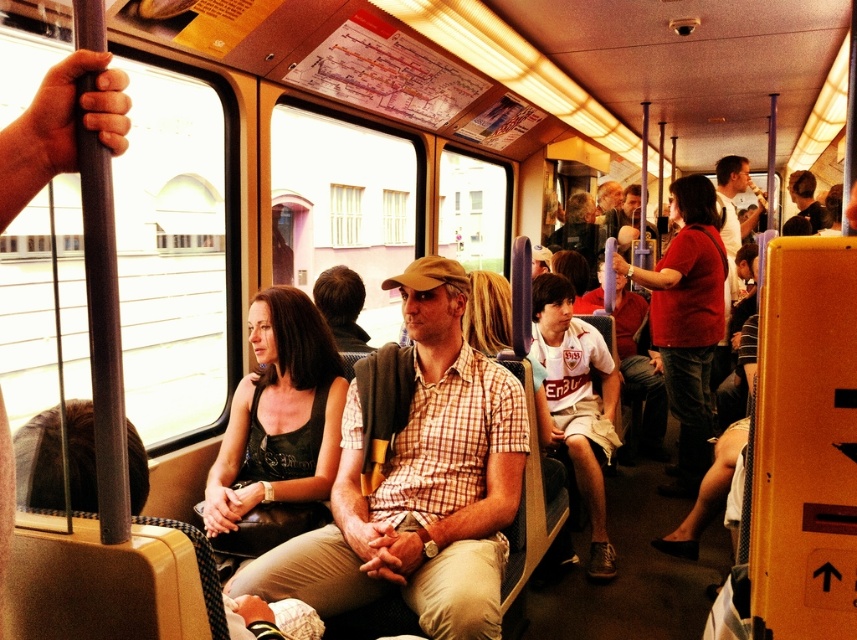
You are standing at the point marked as point (577, 401) in the image. What object are you currently standing on?

The point (577, 401) is on white cotton shirt at center.